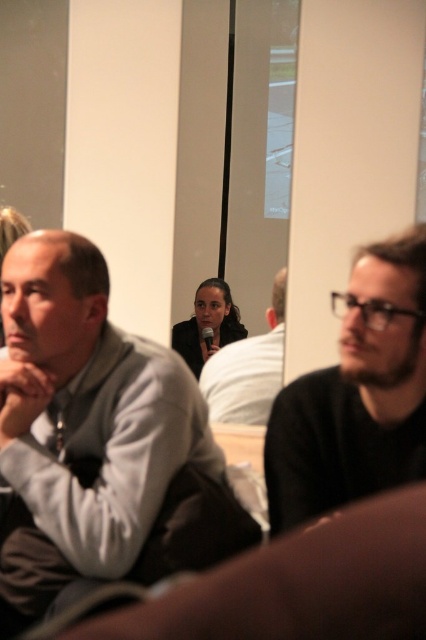
Can you confirm if gray matte sweater at left is positioned to the right of dark gray sweater at center?

In fact, gray matte sweater at left is to the left of dark gray sweater at center.

Who is more forward, (71,280) or (276,332)?

Point (71,280) is in front.

Who is more distant from viewer, [101,392] or [256,348]?

The point [256,348] is behind.

I want to click on gray matte sweater at left, so click(x=83, y=426).

From the picture: Is gray matte sweater at left shorter than dark brown sweater at right?

In fact, gray matte sweater at left may be taller than dark brown sweater at right.

Who is more distant from viewer, [118,499] or [353,371]?

The point [118,499] is more distant.

Find the location of `gray matte sweater at left`. gray matte sweater at left is located at coordinates (83, 426).

Between dark brown sweater at right and dark gray sweater at center, which one appears on the right side from the viewer's perspective?

From the viewer's perspective, dark brown sweater at right appears more on the right side.

Between dark brown sweater at right and dark gray sweater at center, which one appears on the left side from the viewer's perspective?

From the viewer's perspective, dark gray sweater at center appears more on the left side.

Find the location of a particular element. This screenshot has width=426, height=640. dark brown sweater at right is located at coordinates (356, 394).